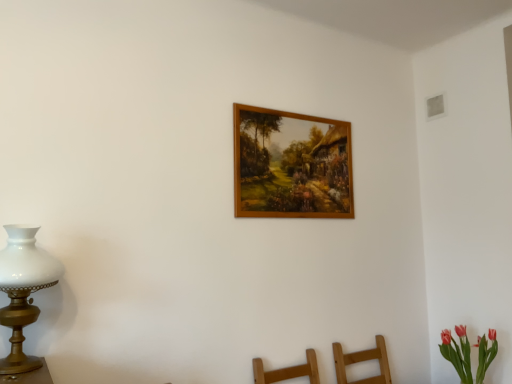
What do you see at coordinates (457, 352) in the screenshot?
I see `vivid pink petals at lower right` at bounding box center [457, 352].

Locate an element on the screen. The height and width of the screenshot is (384, 512). wooden picture frame at upper center is located at coordinates (291, 165).

Which object is wider, vivid pink petals at lower right or wooden picture frame at upper center?

vivid pink petals at lower right.

Consider the image. Considering the relative positions of vivid pink petals at lower right and wooden picture frame at upper center in the image provided, is vivid pink petals at lower right behind wooden picture frame at upper center?

No, it is not.

From the image's perspective, relative to wooden picture frame at upper center, is vivid pink petals at lower right above or below?

vivid pink petals at lower right is situated lower than wooden picture frame at upper center in the image.

Between vivid pink petals at lower right and wooden picture frame at upper center, which one has less height?

With less height is vivid pink petals at lower right.

Is white glass lamp at left at the back of wooden picture frame at upper center?

No, wooden picture frame at upper center is not facing the opposite direction of white glass lamp at left.

Between point (272, 184) and point (23, 358), which one is positioned in front?

Point (23, 358)

From the image's perspective, which object appears higher, wooden picture frame at upper center or white glass lamp at left?

wooden picture frame at upper center appears higher in the image.

Considering the sizes of objects white glass lamp at left and wooden picture frame at upper center in the image provided, who is smaller, white glass lamp at left or wooden picture frame at upper center?

Smaller between the two is wooden picture frame at upper center.

Is white glass lamp at left turned away from wooden picture frame at upper center?

No, wooden picture frame at upper center is not at the back of white glass lamp at left.

The width and height of the screenshot is (512, 384). In the image, there is a white glass lamp at left. What are the coordinates of `picture frame above it (from the image's perspective)` in the screenshot? It's located at (291, 165).

From the image's perspective, which one is positioned higher, white glass lamp at left or wooden picture frame at upper center?

wooden picture frame at upper center.

Does point (240, 193) appear closer or farther from the camera than point (463, 355)?

Point (240, 193) appears to be closer to the viewer than point (463, 355).

Based on the photo, are wooden picture frame at upper center and vivid pink petals at lower right far apart?

That's right, there is a large distance between wooden picture frame at upper center and vivid pink petals at lower right.

Is wooden picture frame at upper center oriented towards vivid pink petals at lower right?

No, wooden picture frame at upper center is not facing towards vivid pink petals at lower right.

Is vivid pink petals at lower right placed right next to white glass lamp at left?

vivid pink petals at lower right and white glass lamp at left are not in contact.

Locate an element on the screen. The image size is (512, 384). floral arrangement on the right of the white glass lamp at left is located at coordinates (457, 352).

Could white glass lamp at left be considered to be inside vivid pink petals at lower right?

Definitely not — white glass lamp at left is not inside vivid pink petals at lower right.

Is vivid pink petals at lower right oriented towards white glass lamp at left?

Yes, vivid pink petals at lower right is turned towards white glass lamp at left.

Considering the points (31, 356) and (463, 337), which point is behind, point (31, 356) or point (463, 337)?

Point (463, 337)

Which object is wider, white glass lamp at left or vivid pink petals at lower right?

Wider between the two is vivid pink petals at lower right.

Considering the sizes of white glass lamp at left and vivid pink petals at lower right in the image, is white glass lamp at left taller or shorter than vivid pink petals at lower right?

white glass lamp at left is taller than vivid pink petals at lower right.

Is white glass lamp at left facing away from vivid pink petals at lower right?

No, vivid pink petals at lower right is not at the back of white glass lamp at left.

Locate an element on the screen. This screenshot has height=384, width=512. picture frame on the left of vivid pink petals at lower right is located at coordinates (291, 165).

Find the location of `table lamp located below the wooden picture frame at upper center (from the image's perspective)`. table lamp located below the wooden picture frame at upper center (from the image's perspective) is located at coordinates point(23,290).

Estimate the real-world distances between objects in this image. Which object is further from white glass lamp at left, wooden picture frame at upper center or vivid pink petals at lower right?

vivid pink petals at lower right lies further to white glass lamp at left than the other object.

From the picture: Which object lies further to the anchor point wooden picture frame at upper center, white glass lamp at left or vivid pink petals at lower right?

The object further to wooden picture frame at upper center is vivid pink petals at lower right.

Considering their positions, is white glass lamp at left positioned closer to vivid pink petals at lower right than wooden picture frame at upper center?

Among the two, wooden picture frame at upper center is located nearer to vivid pink petals at lower right.

Looking at the image, which one is located further to vivid pink petals at lower right, wooden picture frame at upper center or white glass lamp at left?

Based on the image, white glass lamp at left appears to be further to vivid pink petals at lower right.

Looking at the image, which one is located further to wooden picture frame at upper center, vivid pink petals at lower right or white glass lamp at left?

vivid pink petals at lower right.

From the image, which object appears to be nearer to white glass lamp at left, vivid pink petals at lower right or wooden picture frame at upper center?

wooden picture frame at upper center is positioned closer to the anchor white glass lamp at left.

This screenshot has width=512, height=384. In order to click on picture frame between white glass lamp at left and vivid pink petals at lower right from left to right in this screenshot , I will do `click(291, 165)`.